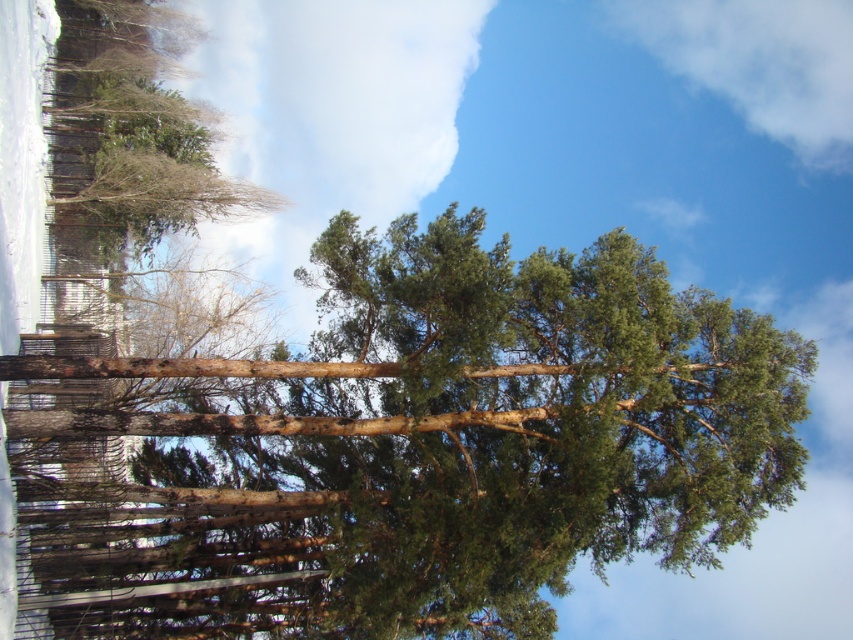
Does green needle-like at center have a smaller size compared to white fluffy cloud at upper right?

No.

Which of these two, green needle-like at center or white fluffy cloud at upper right, stands shorter?

white fluffy cloud at upper right is shorter.

You are a GUI agent. You are given a task and a screenshot of the screen. Output one action in this format:
    pyautogui.click(x=<x>, y=<y>)
    Task: Click on the green needle-like at center
    The width and height of the screenshot is (853, 640).
    Given the screenshot: What is the action you would take?
    pyautogui.click(x=404, y=445)

Find the location of a particular element. This screenshot has height=640, width=853. green needle-like at center is located at coordinates (404, 445).

Does white fluffy cloud at upper center appear on the right side of white fluffy cloud at upper right?

No, white fluffy cloud at upper center is not to the right of white fluffy cloud at upper right.

Based on the photo, who is positioned more to the right, white fluffy cloud at upper center or white fluffy cloud at upper right?

white fluffy cloud at upper right

Who is more forward, (294, 330) or (793, 97)?

Point (294, 330)

Locate an element on the screen. The image size is (853, 640). white fluffy cloud at upper center is located at coordinates coord(328,118).

Is point (177, 541) farther from viewer compared to point (288, 332)?

No.

Locate an element on the screen. green needle-like at center is located at coordinates (404, 445).

Is point (27, 564) in front of point (415, 84)?

Yes, it is.

Identify the location of green needle-like at center. (404, 445).